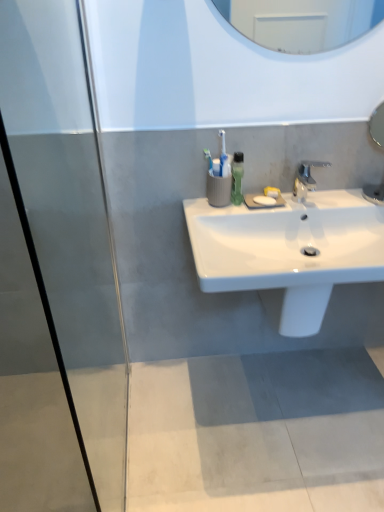
What do you see at coordinates (289, 250) in the screenshot? The image size is (384, 512). I see `white glossy sink at center` at bounding box center [289, 250].

This screenshot has height=512, width=384. Describe the element at coordinates (306, 179) in the screenshot. I see `silver metallic faucet at center` at that location.

Locate an element on the screen. The image size is (384, 512). green matte soap dispenser at upper center is located at coordinates (237, 178).

Is white glossy sink at center bigger than silver metallic faucet at center?

Indeed, white glossy sink at center has a larger size compared to silver metallic faucet at center.

From the image's perspective, who appears lower, white glossy sink at center or silver metallic faucet at center?

From the image's view, white glossy sink at center is below.

Is white glossy sink at center further to the viewer compared to silver metallic faucet at center?

No, white glossy sink at center is closer to the camera.

Is point (302, 189) behind point (236, 161)?

Yes, it is.

Locate an element on the screen. soap dispenser on the left of the silver metallic faucet at center is located at coordinates (237, 178).

In the scene shown: Between silver metallic faucet at center and green matte soap dispenser at upper center, which one has larger width?

silver metallic faucet at center is wider.

Between silver metallic faucet at center and green matte soap dispenser at upper center, which one has more height?

Standing taller between the two is green matte soap dispenser at upper center.

Is green matte soap dispenser at upper center to the left of white glossy sink at center from the viewer's perspective?

Correct, you'll find green matte soap dispenser at upper center to the left of white glossy sink at center.

In the image, there is a white glossy sink at center. In order to click on soap dispenser above it (from the image's perspective) in this screenshot , I will do `click(237, 178)`.

Which object is thinner, green matte soap dispenser at upper center or white glossy sink at center?

Thinner between the two is green matte soap dispenser at upper center.

Is green matte soap dispenser at upper center next to white glossy sink at center?

There is a gap between green matte soap dispenser at upper center and white glossy sink at center.

Between point (307, 191) and point (349, 237), which one is positioned behind?

The point (307, 191) is farther from the camera.

Would you say silver metallic faucet at center is to the left or to the right of white glossy sink at center in the picture?

From the image, it's evident that silver metallic faucet at center is to the right of white glossy sink at center.

Would you say silver metallic faucet at center is a long distance from white glossy sink at center?

No, there isn't a large distance between silver metallic faucet at center and white glossy sink at center.

From the picture: Is silver metallic faucet at center smaller than white glossy sink at center?

Yes, silver metallic faucet at center is smaller than white glossy sink at center.

Is green matte soap dispenser at upper center positioned beyond the bounds of silver metallic faucet at center?

green matte soap dispenser at upper center lies outside silver metallic faucet at center's area.

Is there a large distance between green matte soap dispenser at upper center and silver metallic faucet at center?

No, green matte soap dispenser at upper center is in close proximity to silver metallic faucet at center.

Considering the sizes of objects green matte soap dispenser at upper center and silver metallic faucet at center in the image provided, who is shorter, green matte soap dispenser at upper center or silver metallic faucet at center?

With less height is silver metallic faucet at center.

Between white glossy sink at center and green matte soap dispenser at upper center, which one has smaller size?

green matte soap dispenser at upper center is smaller.

Can you confirm if white glossy sink at center is thinner than green matte soap dispenser at upper center?

Incorrect, the width of white glossy sink at center is not less than that of green matte soap dispenser at upper center.

Which is more to the left, white glossy sink at center or green matte soap dispenser at upper center?

Positioned to the left is green matte soap dispenser at upper center.

In the scene shown: Is white glossy sink at center looking in the opposite direction of green matte soap dispenser at upper center?

No.

Image resolution: width=384 pixels, height=512 pixels. In order to click on tap on the right of white glossy sink at center in this screenshot , I will do `click(306, 179)`.

Identify the location of tap lying below the green matte soap dispenser at upper center (from the image's perspective). Image resolution: width=384 pixels, height=512 pixels. (306, 179).

From the image, which object appears to be farther from green matte soap dispenser at upper center, white glossy sink at center or silver metallic faucet at center?

white glossy sink at center is positioned further to the anchor green matte soap dispenser at upper center.

When comparing their distances from silver metallic faucet at center, does white glossy sink at center or green matte soap dispenser at upper center seem further?

Among the two, white glossy sink at center is located further to silver metallic faucet at center.

From the picture: When comparing their distances from green matte soap dispenser at upper center, does silver metallic faucet at center or white glossy sink at center seem closer?

silver metallic faucet at center is positioned closer to the anchor green matte soap dispenser at upper center.

From the image, which object appears to be nearer to white glossy sink at center, green matte soap dispenser at upper center or silver metallic faucet at center?

The object closer to white glossy sink at center is silver metallic faucet at center.

From the image, which object appears to be nearer to silver metallic faucet at center, green matte soap dispenser at upper center or white glossy sink at center?

Among the two, green matte soap dispenser at upper center is located nearer to silver metallic faucet at center.

When comparing their distances from white glossy sink at center, does silver metallic faucet at center or green matte soap dispenser at upper center seem further?

The object further to white glossy sink at center is green matte soap dispenser at upper center.

The image size is (384, 512). Find the location of `tap positioned between white glossy sink at center and green matte soap dispenser at upper center from near to far`. tap positioned between white glossy sink at center and green matte soap dispenser at upper center from near to far is located at coordinates (306, 179).